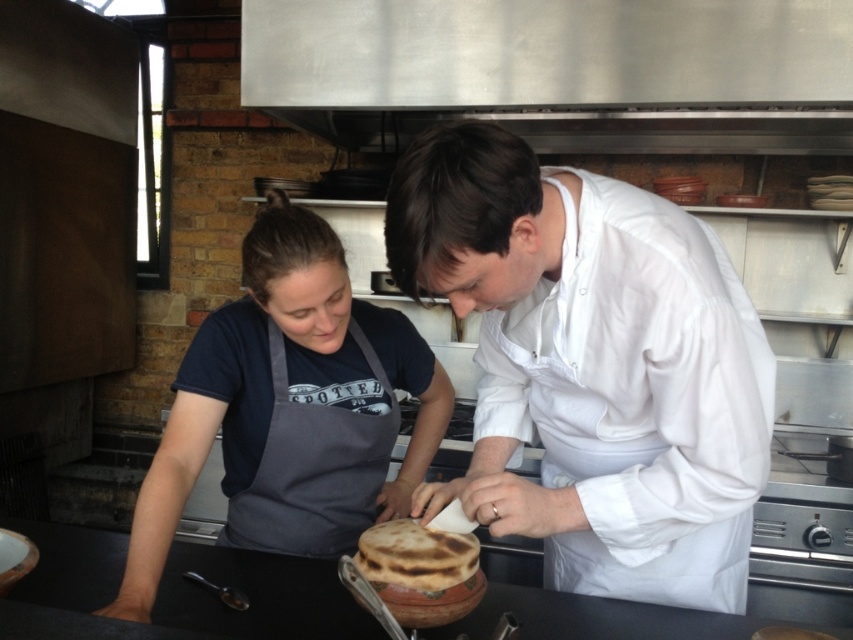
Can you confirm if white matte chef coat at center is shorter than brown matte flatbread at center?

No.

Does white matte chef coat at center appear on the right side of brown matte flatbread at center?

Correct, you'll find white matte chef coat at center to the right of brown matte flatbread at center.

Image resolution: width=853 pixels, height=640 pixels. In order to click on white matte chef coat at center in this screenshot , I will do `click(593, 365)`.

Locate an element on the screen. white matte chef coat at center is located at coordinates (593, 365).

Does white matte chef coat at center have a lesser width compared to dark gray apron at center?

No, white matte chef coat at center is not thinner than dark gray apron at center.

Who is more forward, (x=593, y=275) or (x=337, y=317)?

Positioned in front is point (x=593, y=275).

What are the coordinates of `white matte chef coat at center` in the screenshot? It's located at (593, 365).

Which is below, dark gray apron at center or brown matte flatbread at center?

brown matte flatbread at center is lower down.

Can you confirm if dark gray apron at center is positioned to the left of brown matte flatbread at center?

Correct, you'll find dark gray apron at center to the left of brown matte flatbread at center.

Locate an element on the screen. Image resolution: width=853 pixels, height=640 pixels. dark gray apron at center is located at coordinates (281, 388).